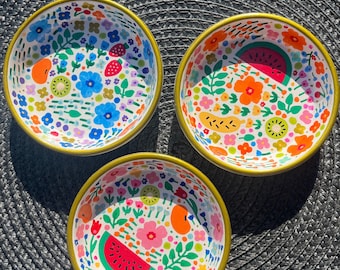
Locate an element on the screen. The width and height of the screenshot is (340, 270). bowl is located at coordinates (209, 215), (126, 110), (231, 111).